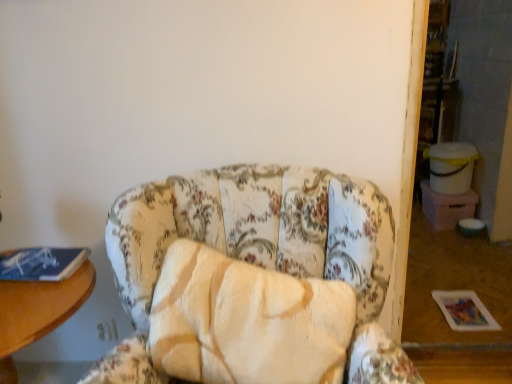
Question: Is blue matte book at left situated inside floral fabric chair at center or outside?

Choices:
 (A) outside
 (B) inside

Answer: (A)

Question: Considering the positions of point (53, 263) and point (227, 301), is point (53, 263) closer or farther from the camera than point (227, 301)?

Choices:
 (A) farther
 (B) closer

Answer: (A)

Question: Estimate the real-world distances between objects in this image. Which object is closer to the wooden table at left?

Choices:
 (A) floral fabric chair at center
 (B) blue matte book at left

Answer: (B)

Question: Which of these objects is positioned closest to the floral fabric chair at center?

Choices:
 (A) wooden table at left
 (B) blue matte book at left

Answer: (A)